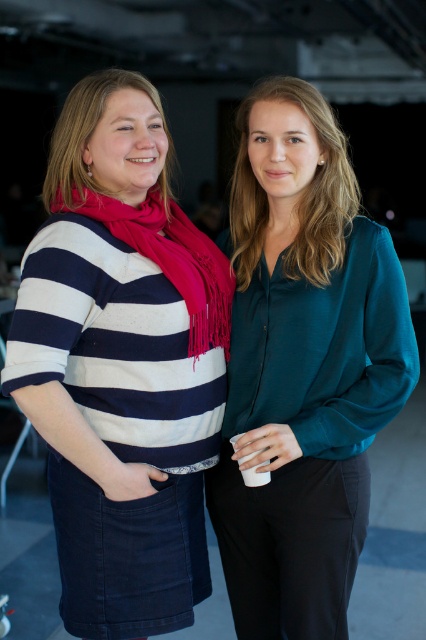
Question: Which is nearer to the matte red scarf at center?

Choices:
 (A) teal silk blouse at center
 (B) striped wool sweater at center

Answer: (B)

Question: Which object appears farthest from the camera in this image?

Choices:
 (A) teal silk blouse at center
 (B) matte red scarf at center
 (C) striped wool sweater at center

Answer: (A)

Question: Does teal silk blouse at center come in front of matte red scarf at center?

Choices:
 (A) yes
 (B) no

Answer: (B)

Question: Which object appears closest to the camera in this image?

Choices:
 (A) teal silk blouse at center
 (B) matte red scarf at center

Answer: (B)

Question: Does striped wool sweater at center appear on the right side of teal silk blouse at center?

Choices:
 (A) yes
 (B) no

Answer: (B)

Question: In this image, where is striped wool sweater at center located relative to matte red scarf at center?

Choices:
 (A) left
 (B) right

Answer: (A)